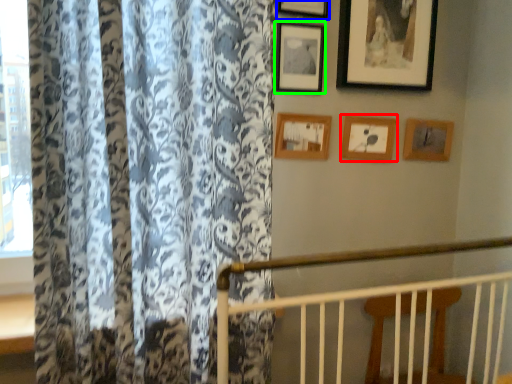
Question: Estimate the real-world distances between objects in this image. Which object is closer to picture frame (highlighted by a red box), picture frame (highlighted by a blue box) or picture frame (highlighted by a green box)?

Choices:
 (A) picture frame
 (B) picture frame

Answer: (B)